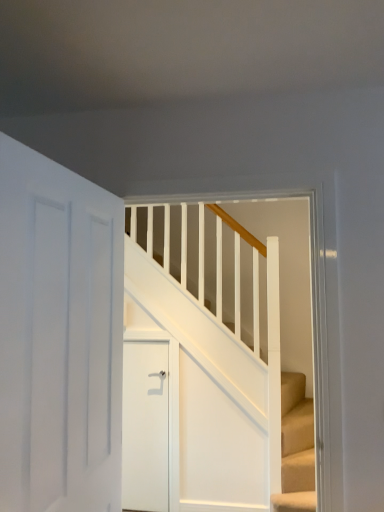
Find the location of a particular element. The image size is (384, 512). free space above white matte door at center, positioned as the second door in front-to-back order (from a real-world perspective) is located at coordinates (140, 340).